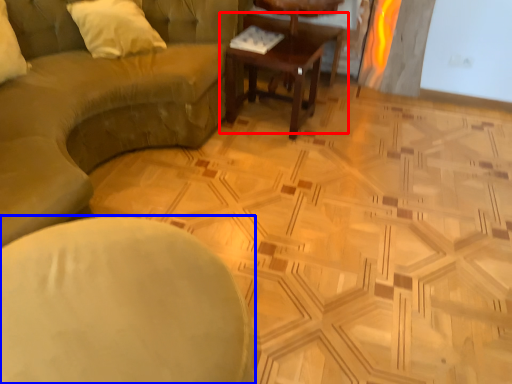
Question: Which of the following is the closest to the observer, coffee table (highlighted by a red box) or chair (highlighted by a blue box)?

Choices:
 (A) coffee table
 (B) chair

Answer: (B)